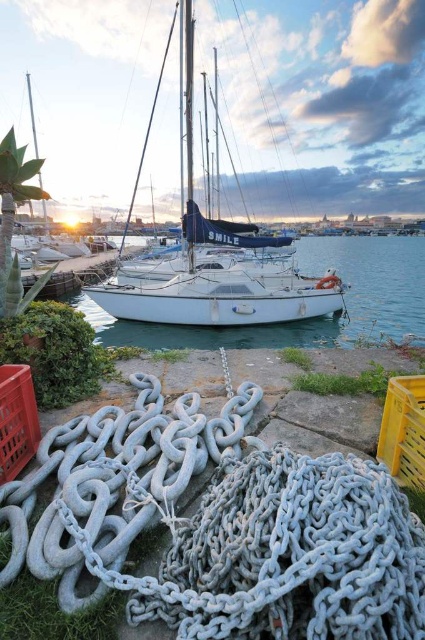
You are a photographer planning to capture the marina scene. You want to ensure that the white matte water at center and the metallic mast at upper center are both visible in your shot. Which object will occupy more space in the photograph?

The white matte water at center will occupy more space in the photograph because it is bigger than the metallic mast at upper center according to the description.

You are standing at the edge of the marina and notice the white matte water at center and the orange plastic crate at lower left. Which object is closer to you?

The white matte water at center is closer to you because it is further to the viewer than the orange plastic crate at lower left.